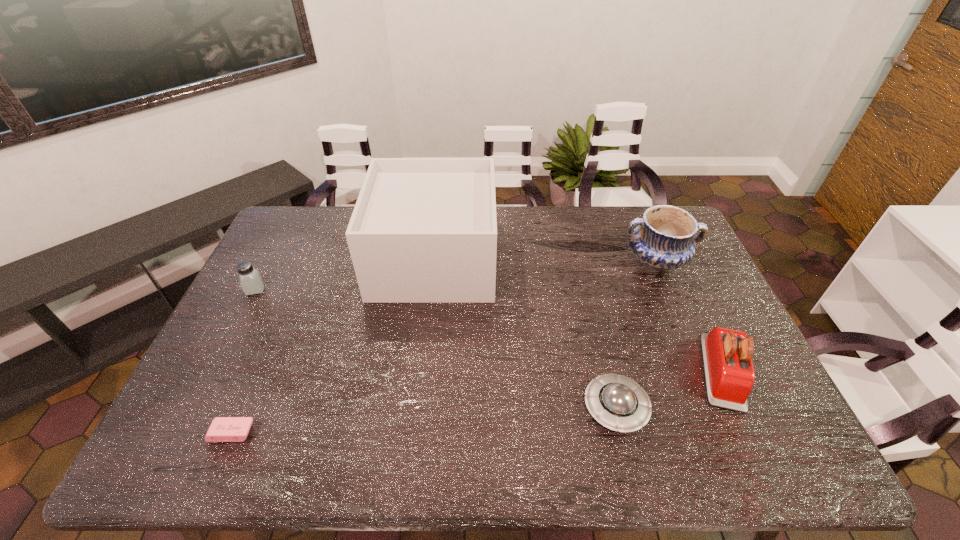
This screenshot has height=540, width=960. I want to click on the tallest object, so pyautogui.click(x=424, y=230).

At what (x,y) coordinates should I click in order to perform the action: click on box. Please return your answer as a coordinate pair (x, y). This screenshot has width=960, height=540. Looking at the image, I should click on (424, 230).

Find the location of a particular element. Image resolution: width=960 pixels, height=540 pixels. pottery is located at coordinates (663, 240).

Find the location of `the third tallest object`. the third tallest object is located at coordinates [x=727, y=354].

You are a GUI agent. You are given a task and a screenshot of the screen. Output one action in this format:
    pyautogui.click(x=<x>, y=<y>)
    Task: Click on the saltshaker
    The width and height of the screenshot is (960, 540).
    Given the screenshot: What is the action you would take?
    pyautogui.click(x=250, y=279)

I want to click on the leftmost object, so click(x=250, y=279).

You are a GUI agent. You are given a task and a screenshot of the screen. Output one action in this format:
    pyautogui.click(x=<x>, y=<y>)
    Task: Click on the fifth tallest object
    
    Given the screenshot: What is the action you would take?
    pyautogui.click(x=617, y=402)

This screenshot has height=540, width=960. What are the coordinates of `saucer` in the screenshot? It's located at (617, 402).

At what (x,y) coordinates should I click in order to perform the action: click on eraser. Please return your answer as a coordinate pair (x, y). The height and width of the screenshot is (540, 960). Looking at the image, I should click on (222, 429).

The height and width of the screenshot is (540, 960). Identify the location of the second object from left to right. (222, 429).